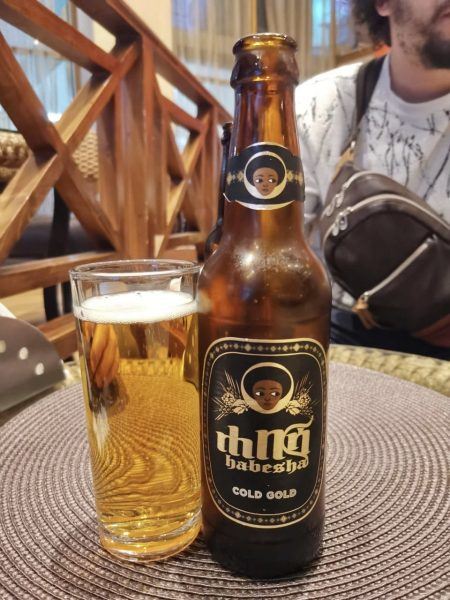
Identify the location of beer bottle. (255, 323).